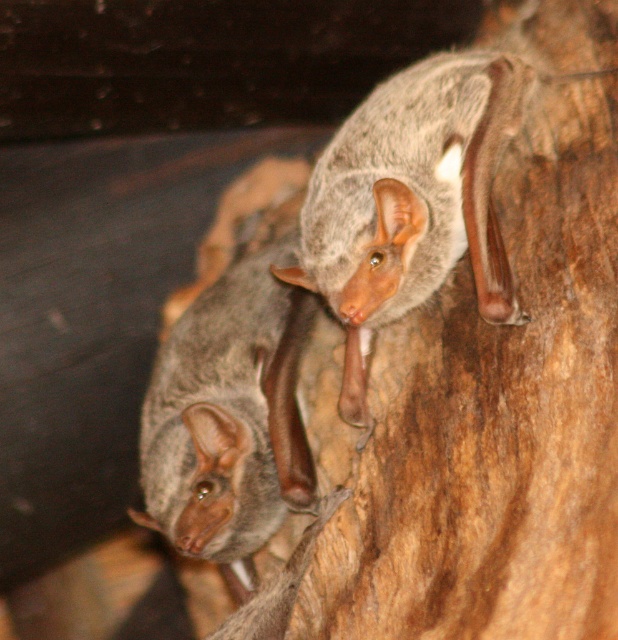
Question: Can you confirm if gray fur bat at upper right is positioned to the left of gray fur bat at lower left?

Choices:
 (A) yes
 (B) no

Answer: (B)

Question: Considering the relative positions of gray fur bat at upper right and gray fur bat at lower left in the image provided, where is gray fur bat at upper right located with respect to gray fur bat at lower left?

Choices:
 (A) above
 (B) below

Answer: (A)

Question: Which of the following is the farthest from the observer?

Choices:
 (A) (455, 113)
 (B) (222, 456)

Answer: (B)

Question: Is gray fur bat at upper right below gray fur bat at lower left?

Choices:
 (A) yes
 (B) no

Answer: (B)

Question: Which object appears closest to the camera in this image?

Choices:
 (A) gray fur bat at upper right
 (B) gray fur bat at lower left

Answer: (A)